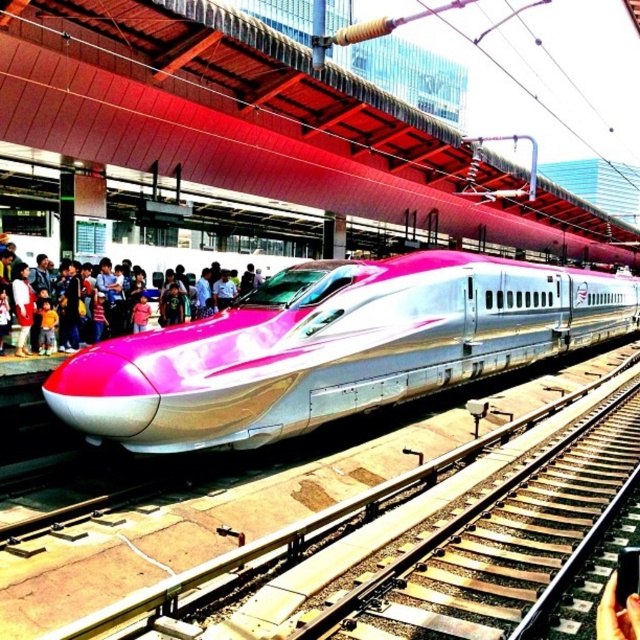
You are standing on the platform at the train station and see both the pink metallic train at center and the pink glossy train at center. Which one is positioned to the right side of the other?

The pink metallic train at center is to the right of the pink glossy train at center.

You are standing on the platform at the train station and see two points marked on the train. The first point is at coordinate point [577,342] and the second is at point [195,262]. Which point is closer to you?

Point [577,342] is further to the viewer than point [195,262], so the point closer to you is point [195,262].

You are standing on the platform of a train station and see both the pink metallic train at center and the pink glossy train at center. If you want to board the nearest train, which one should you walk towards?

The pink metallic train at center is 35.89 feet away from the pink glossy train at center. Since you want to board the nearest train, you should walk towards whichever is closer to your current position. However, the description only provides the distance between the two trains, not their individual distances from you. Without knowing your exact location on the platform, it is impossible to determine which train is closer to you.